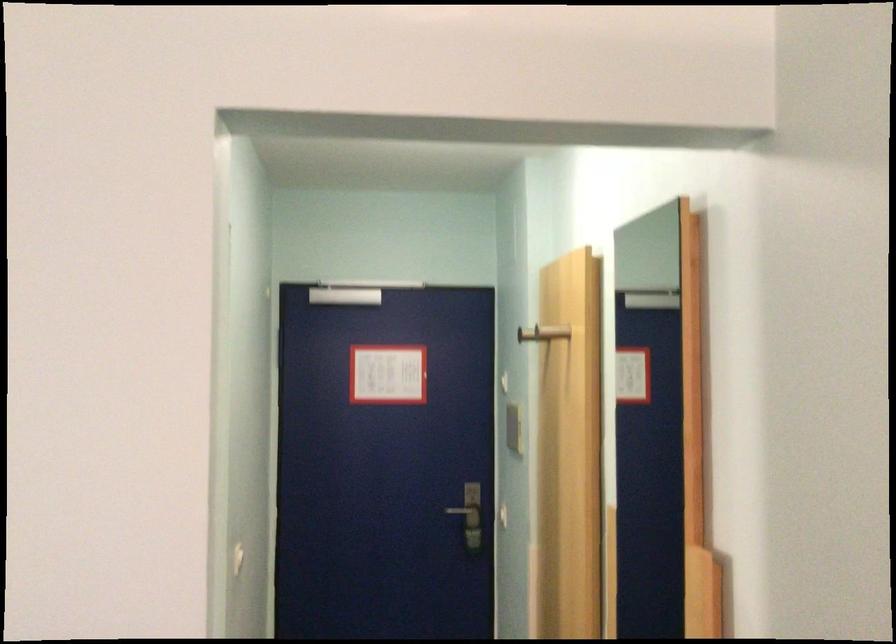
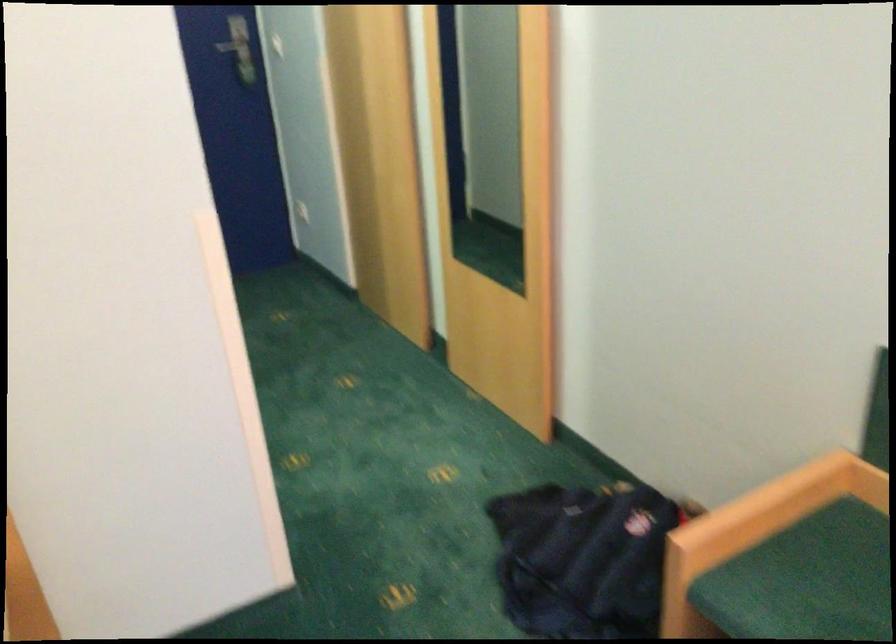
The point at (x=461, y=502) is marked in the first image. Where is the corresponding point in the second image?

(234, 46)